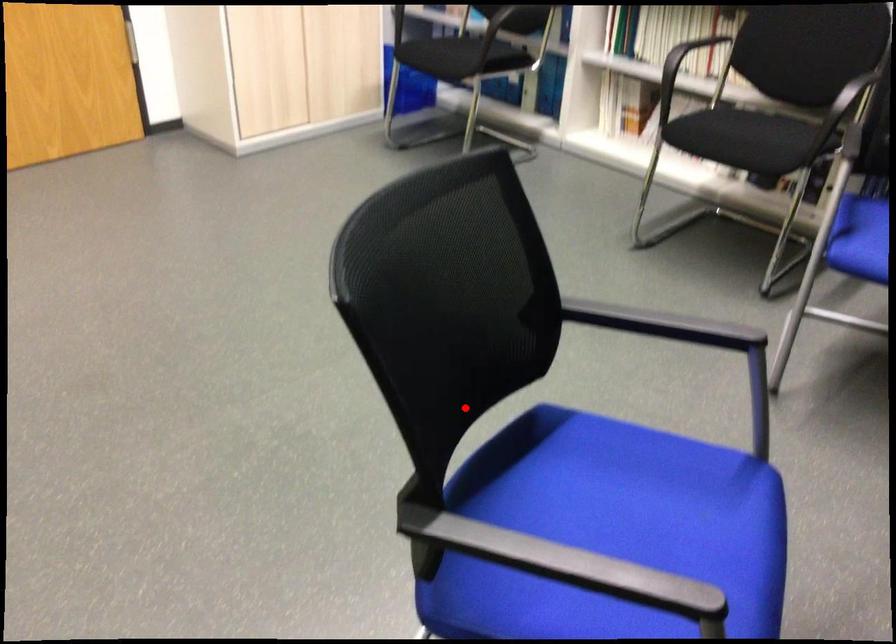
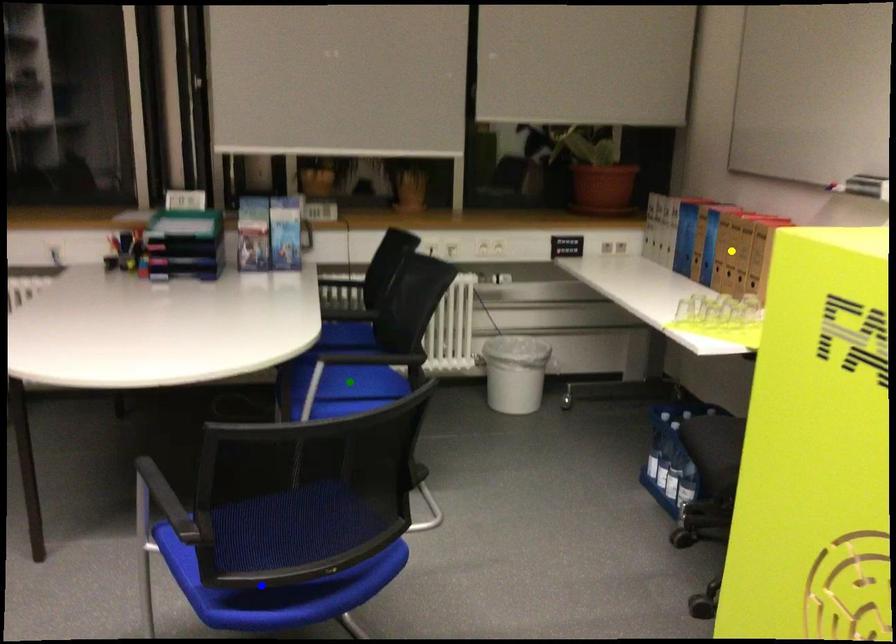
Question: I am providing you with two images of the same scene from different viewpoints. A red point is marked on the first image. You are given multiple points on the second image. Which point in image 2 is actually the same real-world point as the red point in image 1?

Choices:
 (A) green point
 (B) yellow point
 (C) blue point

Answer: (C)